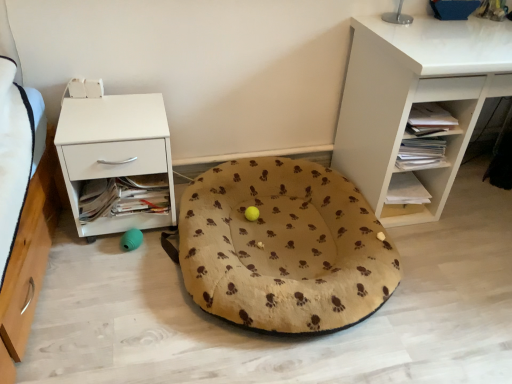
Question: From the image's perspective, is white matte desk at upper right, arranged as the 1th shelf when viewed from the top, on top of beige fabric dog bed at center?

Choices:
 (A) yes
 (B) no

Answer: (A)

Question: Can you confirm if white matte desk at upper right, the 2th shelf when ordered from bottom to top, is smaller than beige fabric dog bed at center?

Choices:
 (A) no
 (B) yes

Answer: (A)

Question: Considering the relative sizes of white matte desk at upper right, the 2th shelf when ordered from bottom to top, and beige fabric dog bed at center in the image provided, is white matte desk at upper right, the 2th shelf when ordered from bottom to top, bigger than beige fabric dog bed at center?

Choices:
 (A) no
 (B) yes

Answer: (B)

Question: Is white matte desk at upper right, arranged as the 1th shelf when viewed from the top, positioned with its back to beige fabric dog bed at center?

Choices:
 (A) yes
 (B) no

Answer: (B)

Question: Does white matte desk at upper right, the 2th shelf when ordered from bottom to top, have a greater width compared to beige fabric dog bed at center?

Choices:
 (A) yes
 (B) no

Answer: (B)

Question: Do you think beige fabric dog bed at center is within white matte nightstand at left, or outside of it?

Choices:
 (A) outside
 (B) inside

Answer: (A)

Question: Looking at their shapes, would you say beige fabric dog bed at center is wider or thinner than white matte nightstand at left?

Choices:
 (A) wide
 (B) thin

Answer: (A)

Question: Visually, is beige fabric dog bed at center positioned to the left or to the right of white matte nightstand at left?

Choices:
 (A) right
 (B) left

Answer: (A)

Question: From the image's perspective, is beige fabric dog bed at center above or below white matte nightstand at left?

Choices:
 (A) above
 (B) below

Answer: (B)

Question: Is beige fabric dog bed at center to the left or to the right of white matte desk at upper right, arranged as the 1th shelf when viewed from the top, in the image?

Choices:
 (A) right
 (B) left

Answer: (B)

Question: Considering the positions of point (185, 211) and point (396, 112), is point (185, 211) closer or farther from the camera than point (396, 112)?

Choices:
 (A) closer
 (B) farther

Answer: (B)

Question: In terms of height, does beige fabric dog bed at center look taller or shorter compared to white matte desk at upper right, the 2th shelf when ordered from bottom to top?

Choices:
 (A) short
 (B) tall

Answer: (A)

Question: From the image's perspective, is beige fabric dog bed at center located above or below white matte desk at upper right, arranged as the 1th shelf when viewed from the top?

Choices:
 (A) above
 (B) below

Answer: (B)

Question: Is white matte desk at upper right, arranged as the 1th shelf when viewed from the top, inside the boundaries of white matte nightstand at left, or outside?

Choices:
 (A) outside
 (B) inside

Answer: (A)

Question: Relative to white matte nightstand at left, is white matte desk at upper right, the 2th shelf when ordered from bottom to top, in front or behind?

Choices:
 (A) behind
 (B) front

Answer: (B)